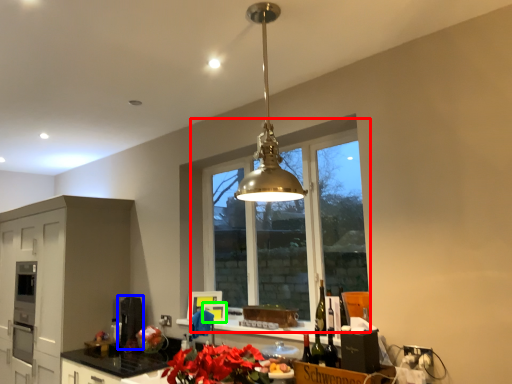
Question: Which object is the closest to the window (highlighted by a red box)? Choose among these: appliance (highlighted by a blue box) or appliance (highlighted by a green box).

Choices:
 (A) appliance
 (B) appliance

Answer: (A)